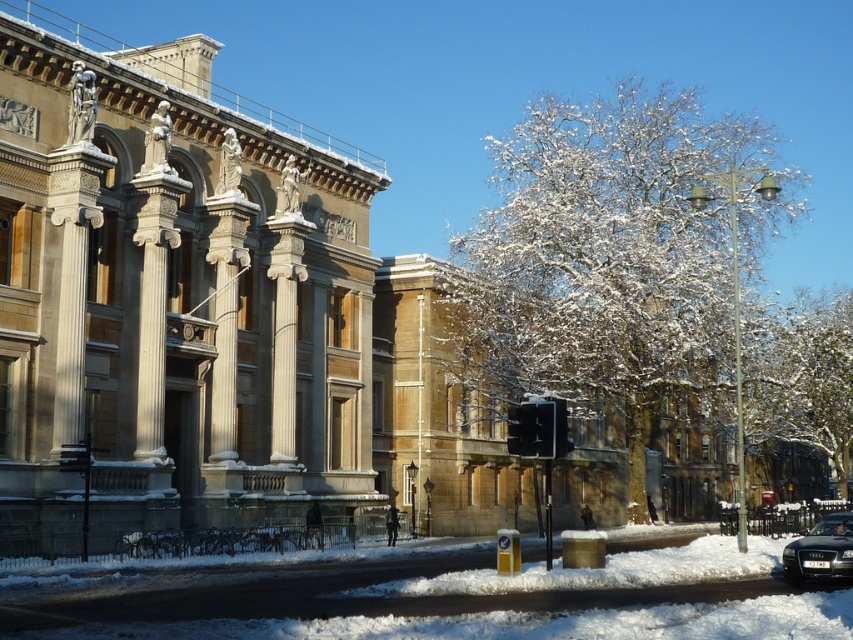
Is point (717, 246) more distant than point (776, 336)?

No, it is not.

Is snow-covered tree at center thinner than white snow-covered tree at upper right?

No.

Which is in front, point (672, 314) or point (795, 301)?

Point (672, 314) is in front.

Locate an element on the screen. snow-covered tree at center is located at coordinates (606, 260).

Does point (830, 449) come in front of point (843, 516)?

No, it is not.

Between white snow-covered tree at upper right and shiny black car at lower right, which one is positioned lower?

Positioned lower is shiny black car at lower right.

Is point (804, 428) positioned behind point (830, 524)?

Yes.

I want to click on white snow-covered tree at upper right, so click(809, 378).

Does snow-covered tree at center have a lesser width compared to shiny black car at lower right?

In fact, snow-covered tree at center might be wider than shiny black car at lower right.

Is snow-covered tree at center below shiny black car at lower right?

Actually, snow-covered tree at center is above shiny black car at lower right.

Does point (527, 243) come farther from viewer compared to point (804, 577)?

Yes, point (527, 243) is farther from viewer.

You are a GUI agent. You are given a task and a screenshot of the screen. Output one action in this format:
    pyautogui.click(x=<x>, y=<y>)
    Task: Click on the snow-covered tree at center
    
    Given the screenshot: What is the action you would take?
    pyautogui.click(x=606, y=260)